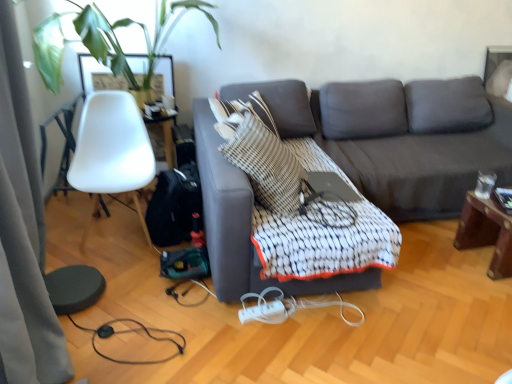
Question: Considering their positions, is black rubber cable at lower left, the 2th cable positioned from the right, located in front of or behind dark gray fabric couch at center?

Choices:
 (A) front
 (B) behind

Answer: (B)

Question: Is black rubber cable at lower left, which appears as the 1th cable when viewed from the left, taller or shorter than dark gray fabric couch at center?

Choices:
 (A) short
 (B) tall

Answer: (A)

Question: Estimate the real-world distances between objects in this image. Which object is closer to the white plastic cable at lower center, positioned as the first cable in right-to-left order?

Choices:
 (A) silky gray curtain at left
 (B) white textured quilt at center
 (C) striped fabric throw pillow at center
 (D) black rubber cable at lower left, which appears as the 1th cable when viewed from the left
 (E) white plastic extension cord at lower center

Answer: (E)

Question: Which of these objects is positioned farthest from the dark gray fabric couch at center?

Choices:
 (A) white textured quilt at center
 (B) mahogany wood side table at right
 (C) white plastic extension cord at lower center
 (D) striped fabric throw pillow at center
 (E) silky gray curtain at left

Answer: (E)